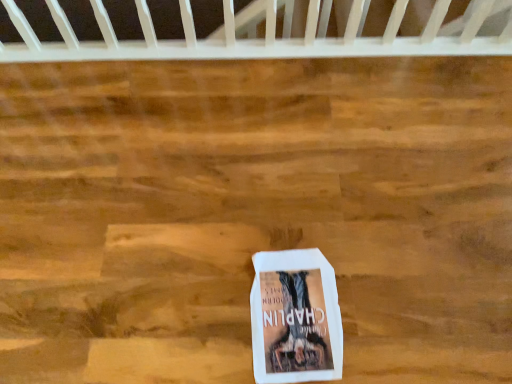
The width and height of the screenshot is (512, 384). Find the location of `free spot behind white paper book at center`. free spot behind white paper book at center is located at coordinates (287, 215).